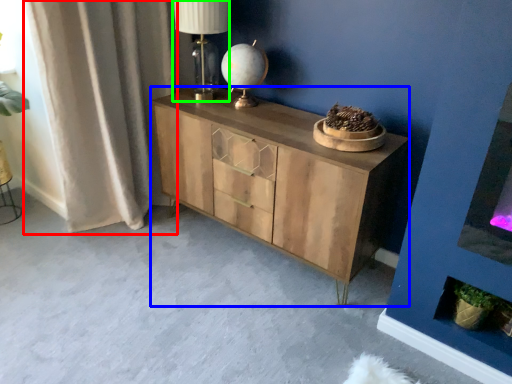
Question: Estimate the real-world distances between objects in this image. Which object is closer to curtain (highlighted by a red box), chest of drawers (highlighted by a blue box) or table lamp (highlighted by a green box)?

Choices:
 (A) chest of drawers
 (B) table lamp

Answer: (B)